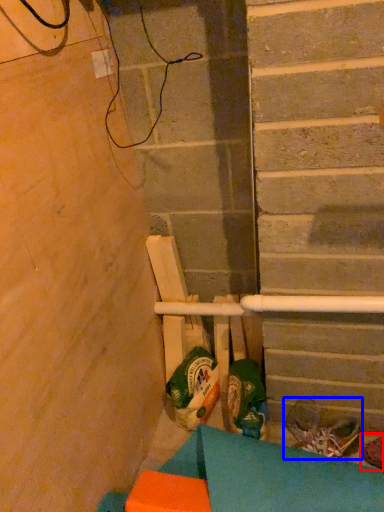
Question: Which object appears closest to the camera in this image, footwear (highlighted by a red box) or footwear (highlighted by a blue box)?

Choices:
 (A) footwear
 (B) footwear

Answer: (A)